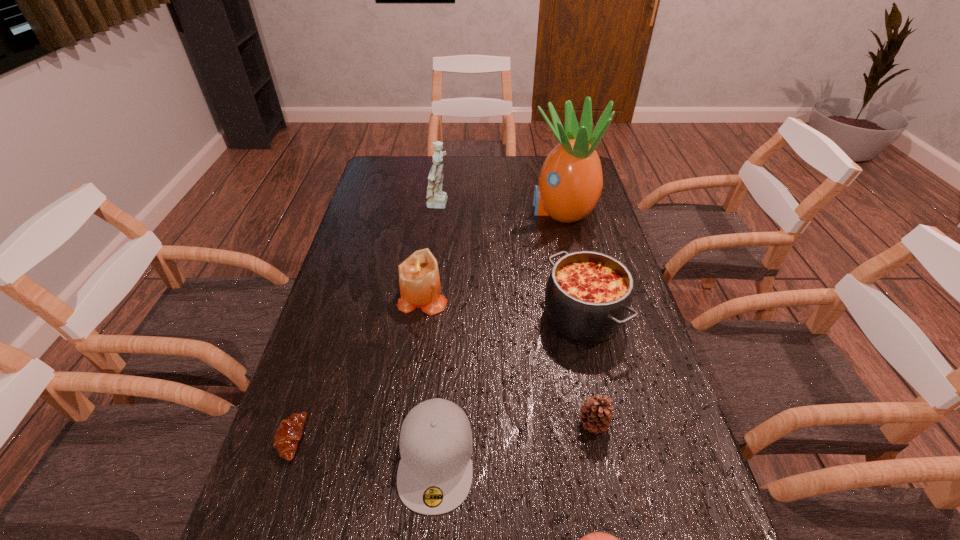
Where is `vacant space that satisfies the following two spatial constraints: 1. at the entrance of the tallest object; 2. on the front-facing side of the cap`? vacant space that satisfies the following two spatial constraints: 1. at the entrance of the tallest object; 2. on the front-facing side of the cap is located at coordinates (620, 457).